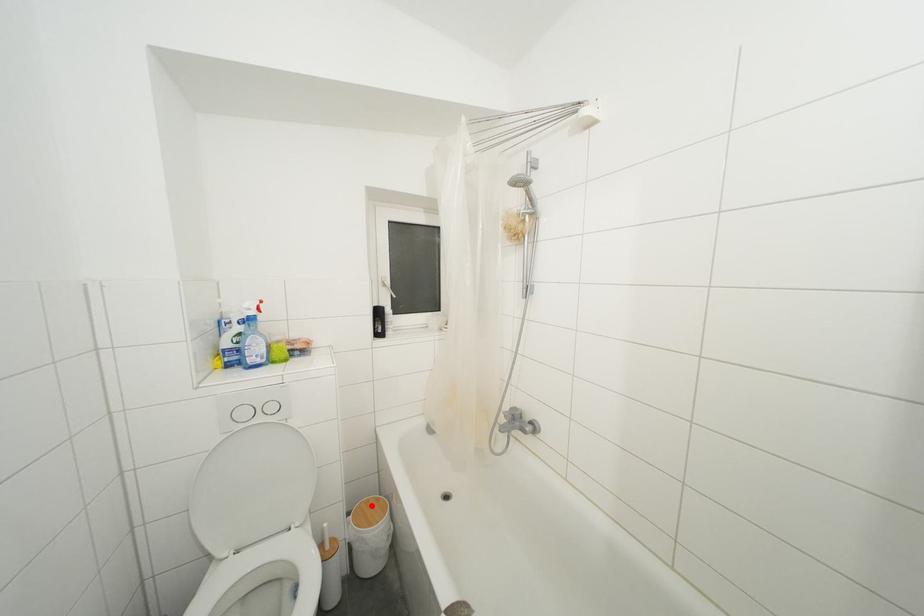
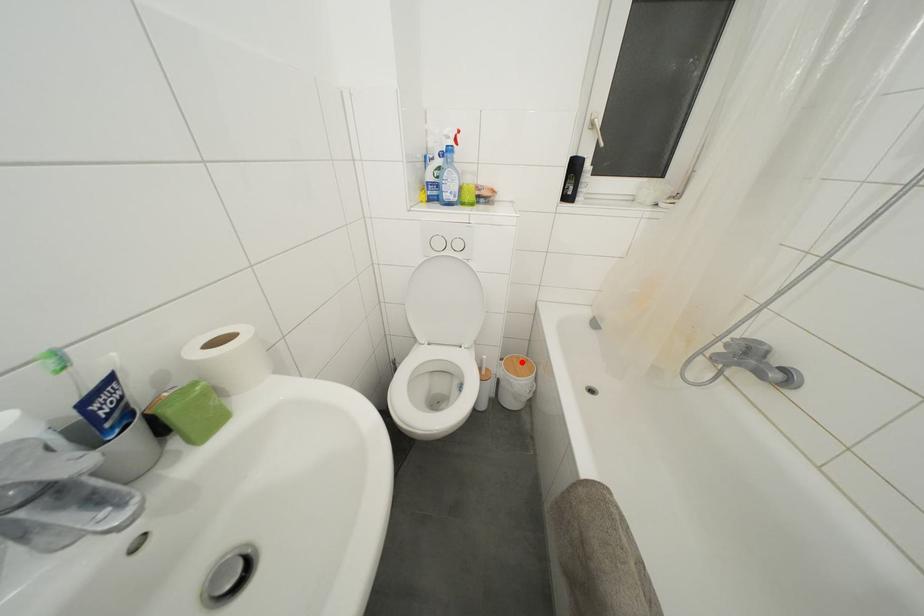
I am providing you with two images of the same scene from different viewpoints. A red point is marked on the first image and another point is marked on the second image. Does the point marked in image1 correspond to the same location as the one in image2?

Yes